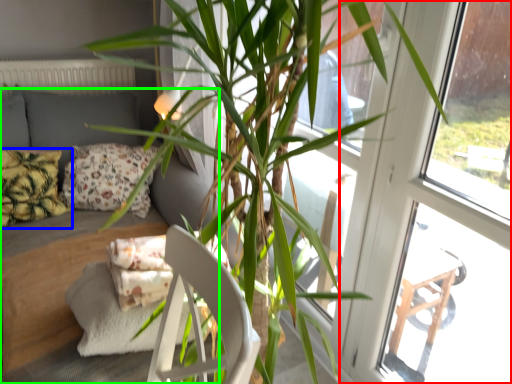
Question: Considering the real-world distances, which object is farthest from screen door (highlighted by a red box)? pillow (highlighted by a blue box) or studio couch (highlighted by a green box)?

Choices:
 (A) pillow
 (B) studio couch

Answer: (A)